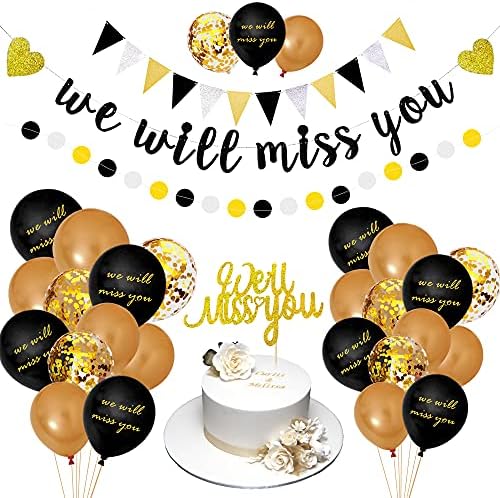
Image resolution: width=500 pixels, height=498 pixels. Identify the location of "we'll miss you" stick in cake. (283, 297).